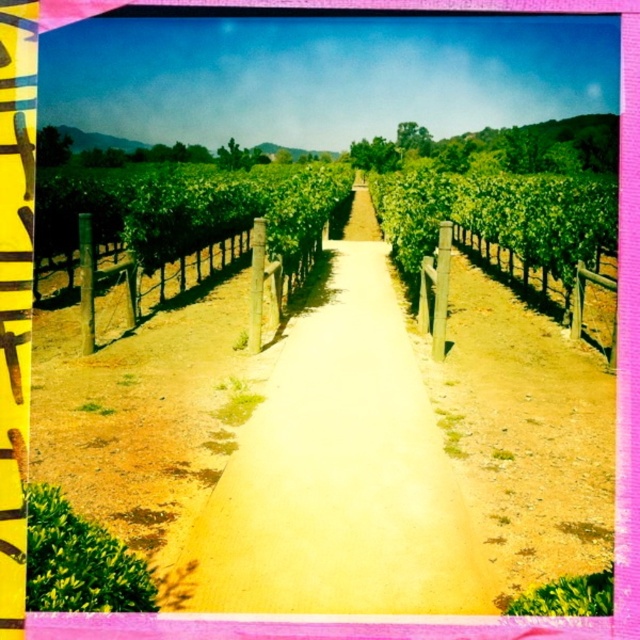
Question: Which point appears farthest from the camera in this image?

Choices:
 (A) (470, 538)
 (B) (113, 280)
 (C) (440, 316)

Answer: (B)

Question: From the image, what is the correct spatial relationship of dirt path at center in relation to wooden post fence at left?

Choices:
 (A) right
 (B) left

Answer: (A)

Question: Does dirt path at center come behind wooden post at center?

Choices:
 (A) yes
 (B) no

Answer: (B)

Question: Which object appears farthest from the camera in this image?

Choices:
 (A) wooden post at center
 (B) dirt path at center

Answer: (A)

Question: Which is farther from the wooden post at center?

Choices:
 (A) dirt path at center
 (B) wooden post fence at left

Answer: (B)

Question: Is wooden post fence at left below wooden post at center?

Choices:
 (A) yes
 (B) no

Answer: (B)